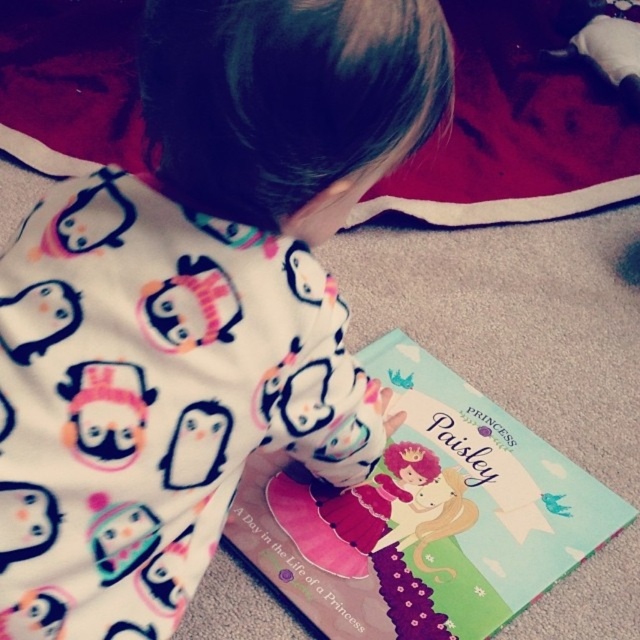
You are a photographer taking a picture of the scene. You want to ensure both the white soft pajamas at center and the matte paper book at center are in focus. Which object should you adjust your camera focus on first to ensure both are sharp?

You should focus on the white soft pajamas at center first because it is closer to the viewer than the matte paper book at center. By focusing on the closer object, the farther object will also be in focus due to the depth of field.

You are a parent who wants to take a photo of your child reading their book. The camera is positioned directly above the scene. Which object, the white soft pajamas at center or the matte paper book at center, will appear larger in the photo?

The white soft pajamas at center is taller than the matte paper book at center, so in the photo taken from above, the white soft pajamas at center will appear larger.